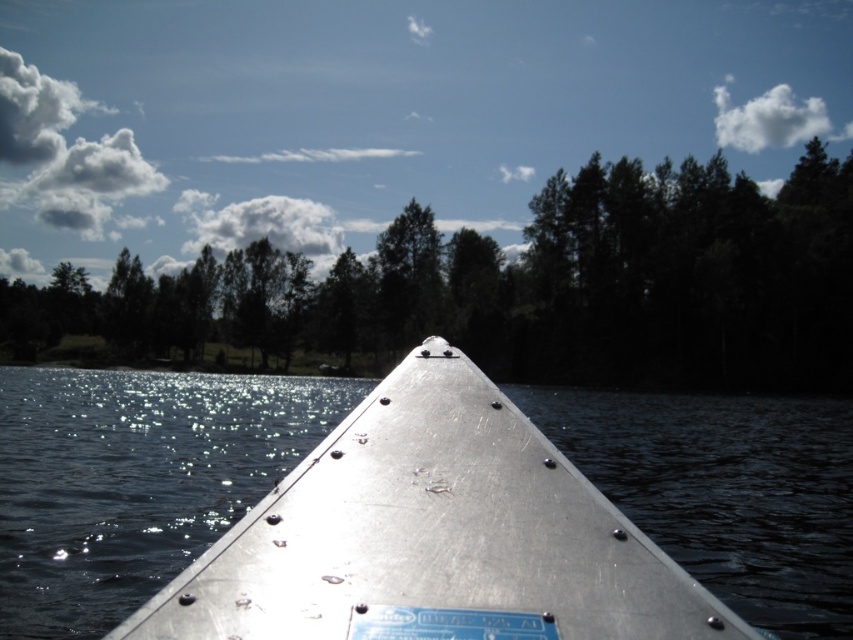
Question: Is green matte tree at upper center thinner than metallic boat at center?

Choices:
 (A) yes
 (B) no

Answer: (B)

Question: Is green matte tree at upper center closer to the viewer compared to metallic boat at center?

Choices:
 (A) yes
 (B) no

Answer: (B)

Question: Does green matte tree at upper center have a lesser width compared to metallic boat at center?

Choices:
 (A) no
 (B) yes

Answer: (A)